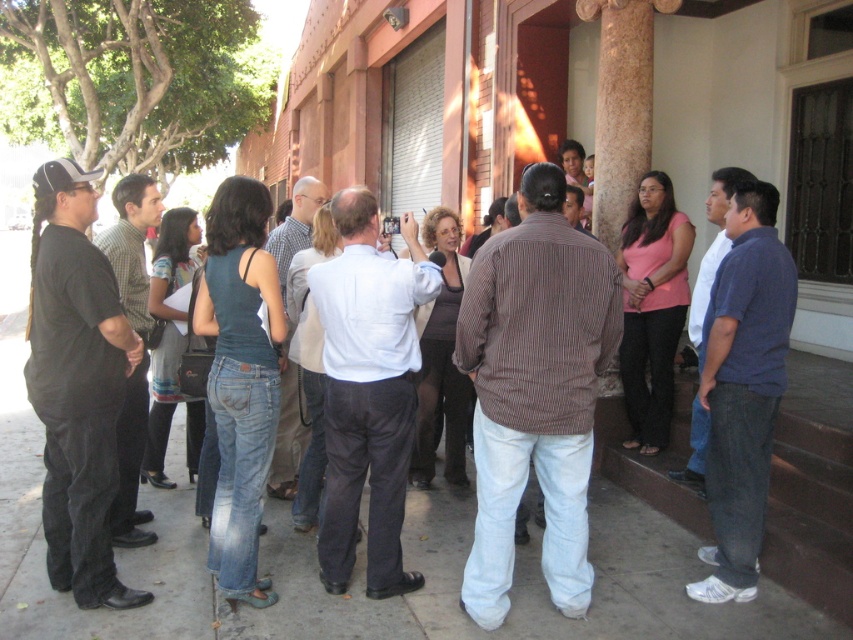
Question: Is white concrete pavement at center to the left of matte black shirt at center from the viewer's perspective?

Choices:
 (A) yes
 (B) no

Answer: (B)

Question: Which of the following is the closest to the observer?

Choices:
 (A) blue cotton shirt at right
 (B) black shirt at left
 (C) brown striped shirt at center
 (D) white concrete pavement at center

Answer: (C)

Question: Among these points, which one is farthest from the camera?

Choices:
 (A) (718, 342)
 (B) (132, 461)
 (C) (282, 576)

Answer: (B)

Question: Which object is farther from the camera taking this photo?

Choices:
 (A) brown striped shirt at center
 (B) blue cotton shirt at right
 (C) white concrete pavement at center

Answer: (B)

Question: In this image, where is black cotton shirt at left located relative to blue cotton shirt at right?

Choices:
 (A) left
 (B) right

Answer: (A)

Question: Can you confirm if white concrete pavement at center is wider than blue jeans at right?

Choices:
 (A) no
 (B) yes

Answer: (B)